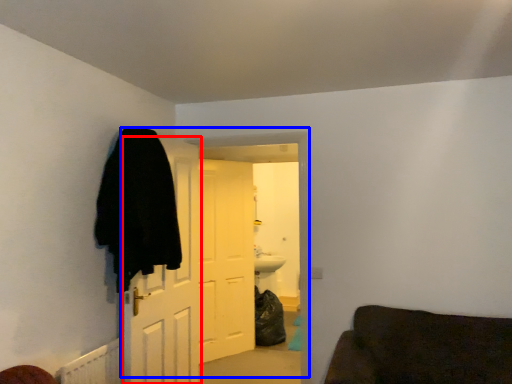
Question: Which object is further to the camera taking this photo, door (highlighted by a red box) or door (highlighted by a blue box)?

Choices:
 (A) door
 (B) door

Answer: (B)